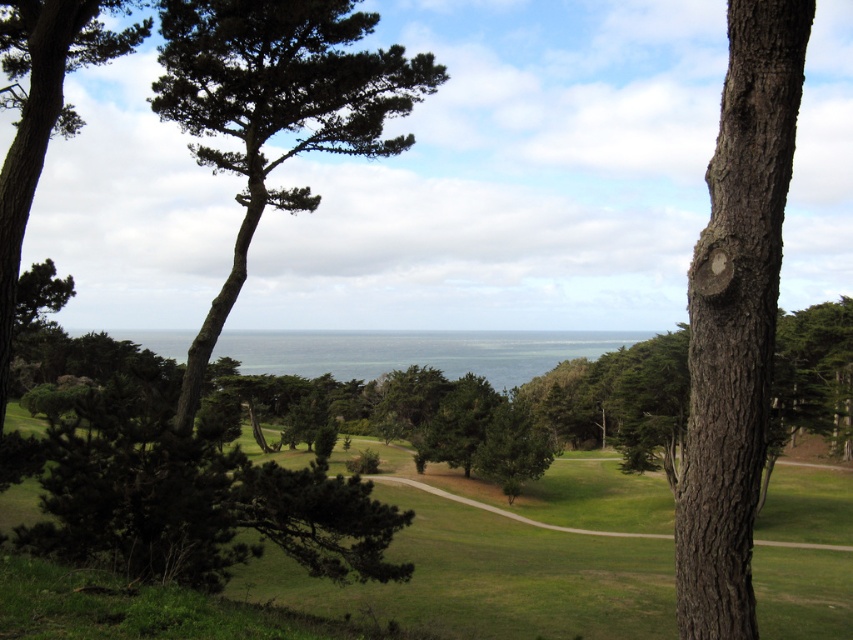
Is brown rough bark tree trunk at right in front of green needle-like leaves at center?

That is True.

Between point (740, 476) and point (309, 81), which one is positioned in front?

Positioned in front is point (740, 476).

Does point (788, 100) come behind point (283, 1)?

No, (788, 100) is closer to viewer.

Where is `brown rough bark tree trunk at right`? The image size is (853, 640). brown rough bark tree trunk at right is located at coordinates (735, 317).

Is point (329, 584) positioned after point (363, 61)?

That is True.

How distant is green grassy golf course at center from green needle-like leaves at center?

green grassy golf course at center and green needle-like leaves at center are 65.14 feet apart.

What do you see at coordinates (486, 579) in the screenshot? I see `green grassy golf course at center` at bounding box center [486, 579].

Where is `green grassy golf course at center`? The image size is (853, 640). green grassy golf course at center is located at coordinates (486, 579).

Does brown rough bark tree trunk at right have a smaller size compared to green matte tree at center?

No.

Who is shorter, brown rough bark tree trunk at right or green matte tree at center?

Standing shorter between the two is green matte tree at center.

Is point (704, 380) positioned after point (448, 465)?

No.

Where is `brown rough bark tree trunk at right`? The height and width of the screenshot is (640, 853). brown rough bark tree trunk at right is located at coordinates (735, 317).